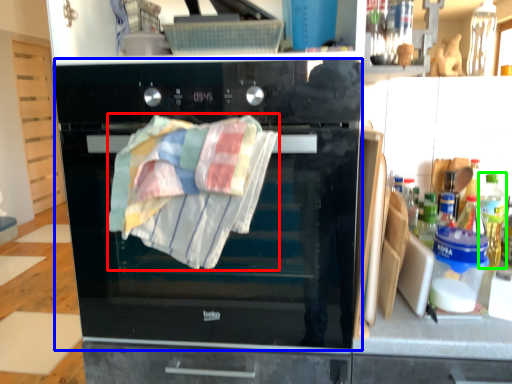
Question: Estimate the real-world distances between objects in this image. Which object is farther from beach towel (highlighted by a red box), oven (highlighted by a blue box) or bottle (highlighted by a green box)?

Choices:
 (A) oven
 (B) bottle

Answer: (B)